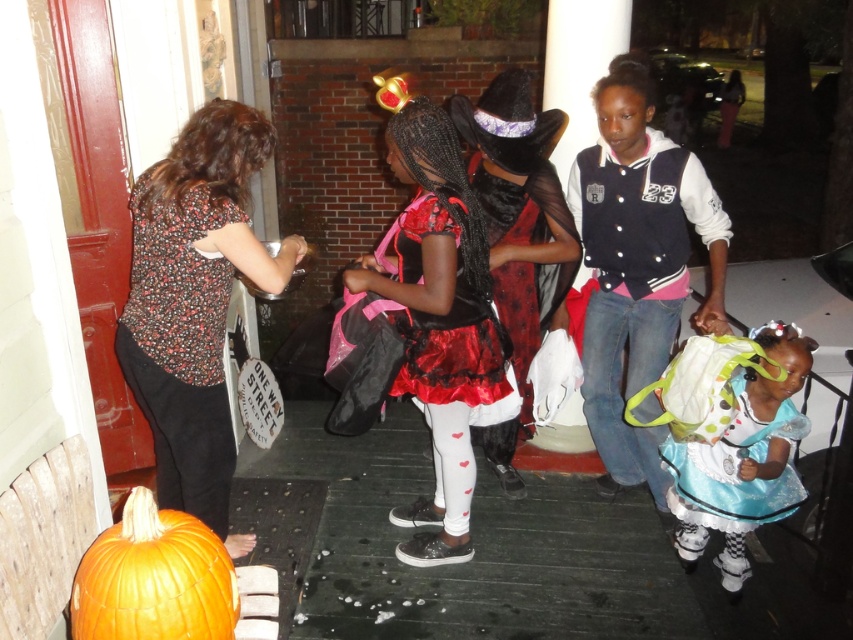
You are a photographer standing at the center of the scene. You want to take a photo of the velvet black jacket at center. Where should you position your camera to capture it best?

The velvet black jacket at center is located at the coordinates point (x=636, y=262), so positioning the camera at the center of the scene would allow you to capture it effectively.

You are a photographer taking pictures of the Halloween scene. You want to focus on the floral blouse at left and the shiny satin dress at center. Which one should you adjust your camera to focus on first if you want to capture both in sharp detail?

The floral blouse at left is closer to the viewer than the shiny satin dress at center, so you should focus on the floral blouse at left first to ensure both are in sharp detail.

You are a costume designer observing the Halloween scene. You need to determine if the floral blouse at left can be paired with the orange matte pumpkin at lower left for a cohesive look. Given their distance apart, can you place them together without moving more than 25 inches?

The floral blouse at left and orange matte pumpkin at lower left are 25.90 inches apart. Since the maximum allowed distance is 25 inches, they cannot be placed together without moving more than 25 inches.